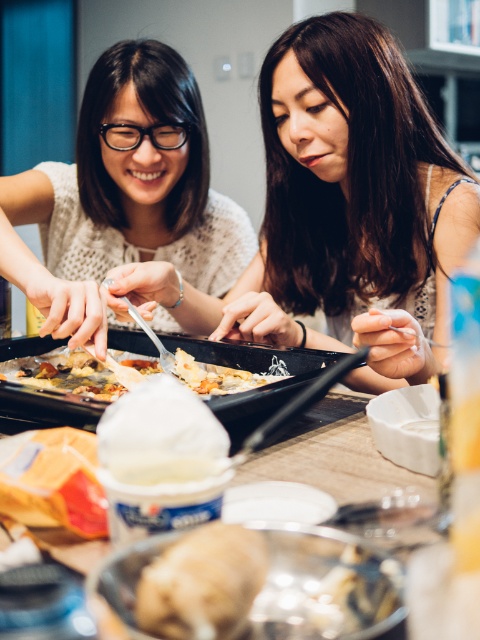
You are a guest at this table and want to reach for the brown crumbly bread at lower center without moving the golden crispy pastry at center. Is this possible?

The brown crumbly bread at lower center is positioned under the golden crispy pastry at center, so you can reach it without moving the pastry by lifting it from underneath.

You are planning to place a new decorative item on the dining table. The item is 15 cm in diameter. Considering the existing items, will the matte black tray at center and the golden crispy pastry at center allow enough space for it?

The matte black tray at center is larger than the golden crispy pastry at center. However, without knowing the exact dimensions of either object or the available space on the table, it is impossible to determine if the 15 cm decorative item will fit. Please measure the space or adjust the placement accordingly.